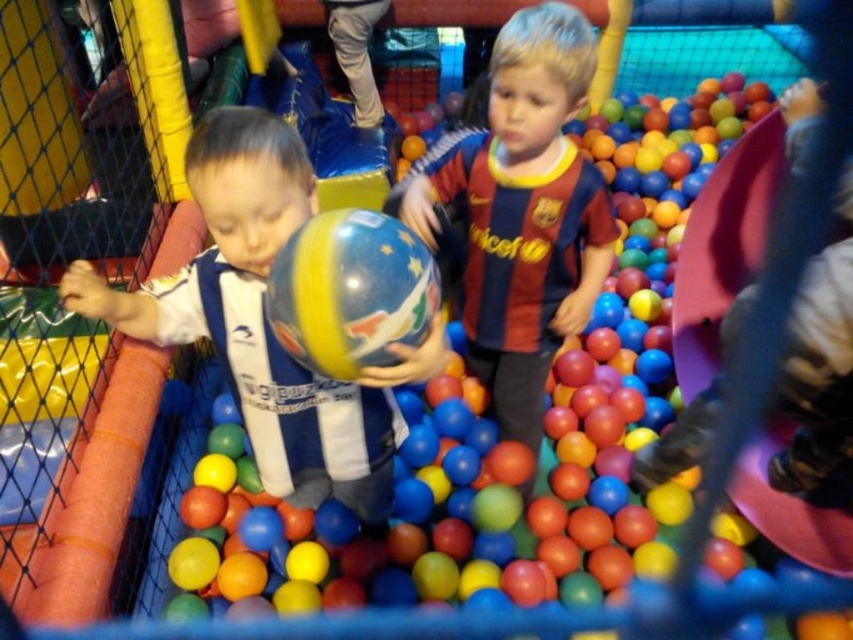
Is white striped jersey at left shorter than glossy rubber ball at center?

Incorrect, white striped jersey at left's height does not fall short of glossy rubber ball at center's.

Between point (113, 321) and point (488, 620), which one is positioned behind?

Positioned behind is point (488, 620).

The width and height of the screenshot is (853, 640). In order to click on white striped jersey at left in this screenshot , I will do `click(265, 321)`.

Who is higher up, maroon jersey at center or glossy rubber ball at center?

maroon jersey at center is above.

Between point (583, 205) and point (177, 632), which one is positioned behind?

The point (583, 205) is behind.

At what (x,y) coordinates should I click in order to perform the action: click on maroon jersey at center. Please return your answer as a coordinate pair (x, y). The height and width of the screenshot is (640, 853). Looking at the image, I should click on (521, 212).

Which is more to the right, white striped jersey at left or maroon jersey at center?

maroon jersey at center is more to the right.

Can you confirm if white striped jersey at left is positioned to the left of maroon jersey at center?

Yes, white striped jersey at left is to the left of maroon jersey at center.

Measure the distance between point (248, 432) and camera.

They are 4.84 feet apart.

Locate an element on the screen. The image size is (853, 640). white striped jersey at left is located at coordinates (265, 321).